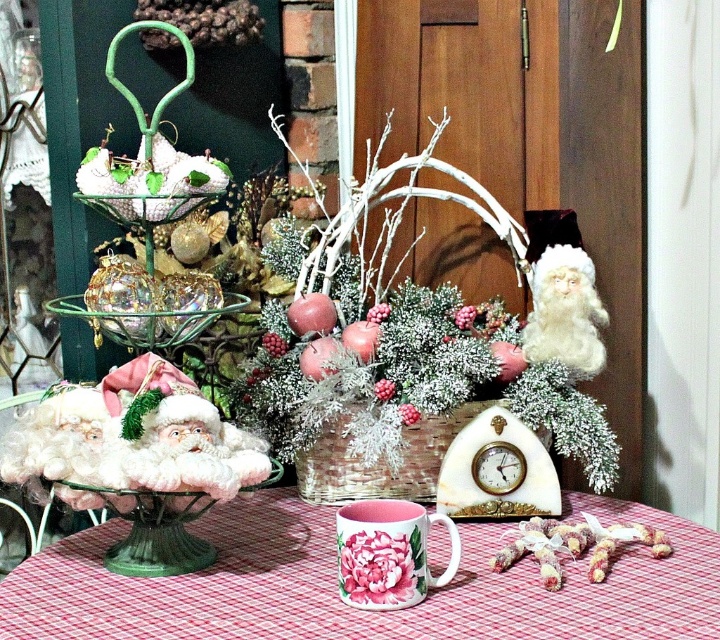
Consider the image. You are a guest at this holiday table and want to reach for the pink ceramic mug at lower center without disturbing the white fluffy santa at right. Is the mug accessible from your current position?

The pink ceramic mug at lower center is positioned under the white fluffy santa at right, so you can reach the pink ceramic mug at lower center without moving the santa since it is located beneath it.

You are a guest at a holiday party and want to grab the pink ceramic mug at lower center to take a sip. However, you notice the white fluffy santa at right is in your way. Can you reach the mug without moving the santa?

The pink ceramic mug at lower center is closer to the viewer than the white fluffy santa at right, so yes, you can reach the mug without moving the santa because it is nearer to you.